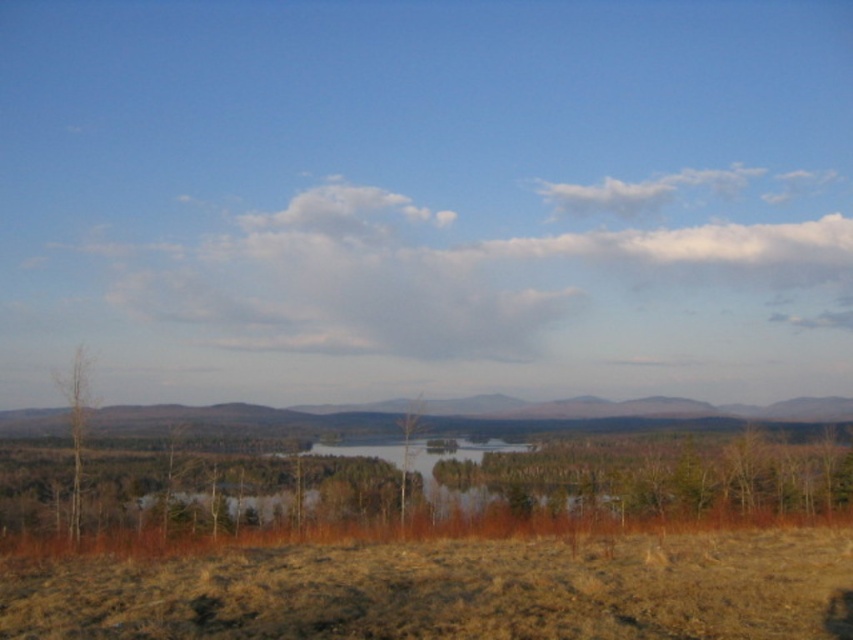
Which is behind, point (74, 524) or point (412, 444)?

Positioned behind is point (412, 444).

At what (x,y) coordinates should I click in order to perform the action: click on bare wood tree at left. Please return your answer as a coordinate pair (x, y). Image resolution: width=853 pixels, height=640 pixels. Looking at the image, I should click on (76, 428).

Where is `bare wood tree at left`? The image size is (853, 640). bare wood tree at left is located at coordinates (76, 428).

Which is above, brown textured mountain at center or brown rough tree at center?

brown rough tree at center is higher up.

Is point (813, 404) positioned before point (418, 416)?

No, (813, 404) is behind (418, 416).

Is point (294, 432) closer to camera compared to point (415, 420)?

No, (294, 432) is further to viewer.

Identify the location of brown textured mountain at center. (628, 412).

Can you confirm if white fluffy cloud at upper center is thinner than brown grassland at lower center?

In fact, white fluffy cloud at upper center might be wider than brown grassland at lower center.

Is the position of white fluffy cloud at upper center more distant than that of brown grassland at lower center?

Yes, white fluffy cloud at upper center is behind brown grassland at lower center.

Is point (846, 220) in front of point (593, 572)?

No, (846, 220) is further to viewer.

The image size is (853, 640). What are the coordinates of `white fluffy cloud at upper center` in the screenshot? It's located at (469, 278).